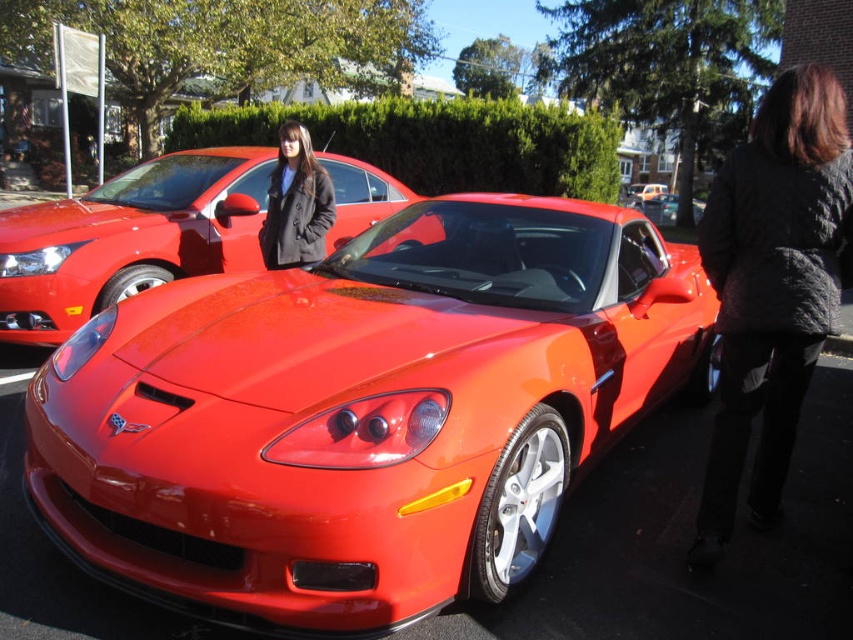
You are a photographer trying to capture both the shiny red sports car at center and the matte black jacket at center in your shot. Since you want the car to be the main focus, which object should you position closer to the camera to achieve this?

To make the shiny red sports car at center the main focus, you should position it closer to the camera since it is already closer to the viewer than the matte black jacket at center, drawing more attention.

You are a photographer trying to capture both cars in a single frame. Since the shiny metallic sports car at center is taller than the shiny red sports car at center, which car should you position closer to the camera to ensure both are fully visible in the photo?

To ensure both the shiny metallic sports car at center and the shiny red sports car at center are fully visible in the photo, position the taller shiny metallic sports car at center closer to the camera. This adjustment will help maintain the proportions so both cars fit within the frame without one being cut off.